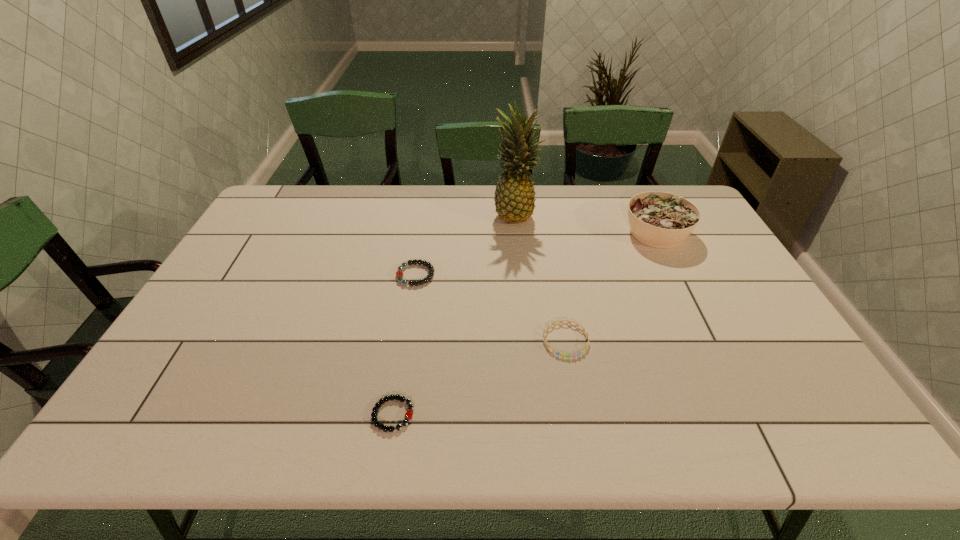
Where is `vacant space at the right edge of the desktop`? Image resolution: width=960 pixels, height=540 pixels. vacant space at the right edge of the desktop is located at coordinates (736, 335).

The height and width of the screenshot is (540, 960). In the image, there is a desktop. In order to click on free region at the far right corner in this screenshot , I will do click(x=655, y=188).

This screenshot has width=960, height=540. I want to click on free area in between the farthest bracelet and the nearest bracelet, so click(x=404, y=345).

Where is `vacant point located between the rightmost bracelet and the rightmost object`? Image resolution: width=960 pixels, height=540 pixels. vacant point located between the rightmost bracelet and the rightmost object is located at coordinates (612, 287).

Image resolution: width=960 pixels, height=540 pixels. In order to click on vacant point located between the third nearest object and the nearest object in this screenshot , I will do `click(404, 345)`.

Where is `empty location between the farthest bracelet and the pineapple`? The image size is (960, 540). empty location between the farthest bracelet and the pineapple is located at coordinates (466, 245).

Locate an element on the screen. The image size is (960, 540). free space between the pineapple and the second nearest object is located at coordinates (540, 278).

This screenshot has height=540, width=960. Find the location of `vacant area that lies between the second tallest object and the rightmost bracelet`. vacant area that lies between the second tallest object and the rightmost bracelet is located at coordinates (612, 287).

I want to click on vacant point located between the farthest bracelet and the pineapple, so click(x=466, y=245).

In order to click on unoccupied position between the fourth shortest object and the rightmost bracelet in this screenshot , I will do [x=612, y=287].